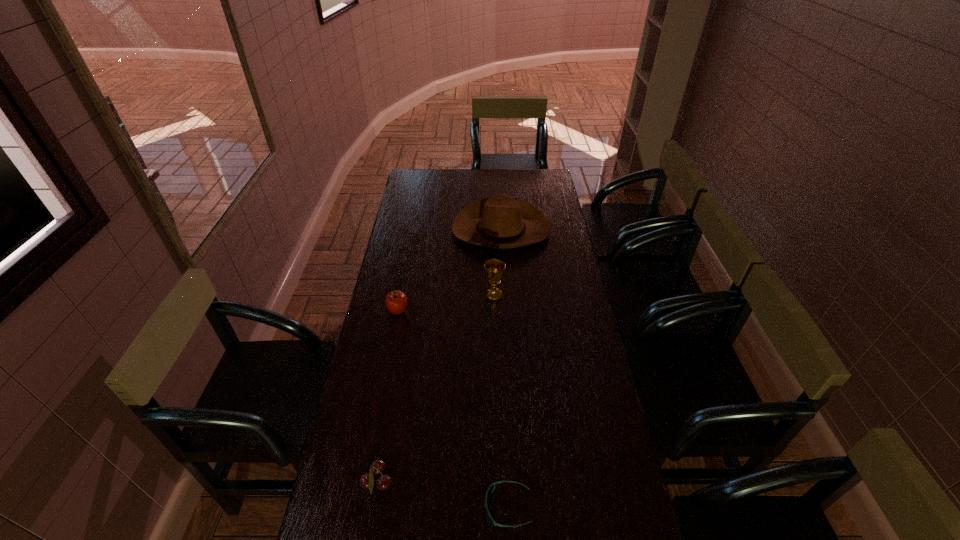
This screenshot has width=960, height=540. Identify the location of free location located 0.330m on the front-facing side of the sunglasses. (x=362, y=507).

Identify the location of vacant region located on the front-facing side of the sunglasses. The image size is (960, 540). (343, 507).

Image resolution: width=960 pixels, height=540 pixels. Find the location of `apple positioned at the left edge`. apple positioned at the left edge is located at coordinates (396, 301).

The width and height of the screenshot is (960, 540). I want to click on cherry at the left edge, so click(367, 481).

I want to click on object that is at the right edge, so click(501, 222).

Identify the location of free point at the far edge. (454, 187).

Find the location of a particular element. The width and height of the screenshot is (960, 540). vacant space at the left edge of the desktop is located at coordinates pos(425,193).

The height and width of the screenshot is (540, 960). Identify the location of free spot at the right edge of the desktop. (531, 198).

The width and height of the screenshot is (960, 540). Find the location of `free spot between the cherry and the apple`. free spot between the cherry and the apple is located at coordinates (388, 397).

This screenshot has height=540, width=960. Identify the location of free spot between the second shortest object and the second farthest object. (436, 389).